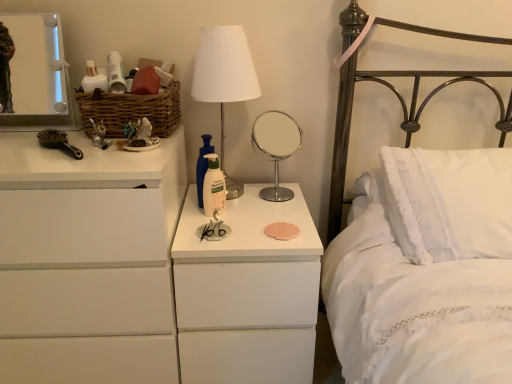
Identify the location of free space behind white matte lotion at center. (244, 198).